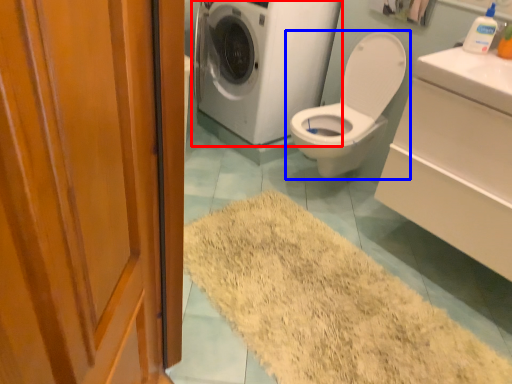
Question: Which of the following is the farthest to the observer, washing machine (highlighted by a red box) or toilet (highlighted by a blue box)?

Choices:
 (A) washing machine
 (B) toilet

Answer: (A)